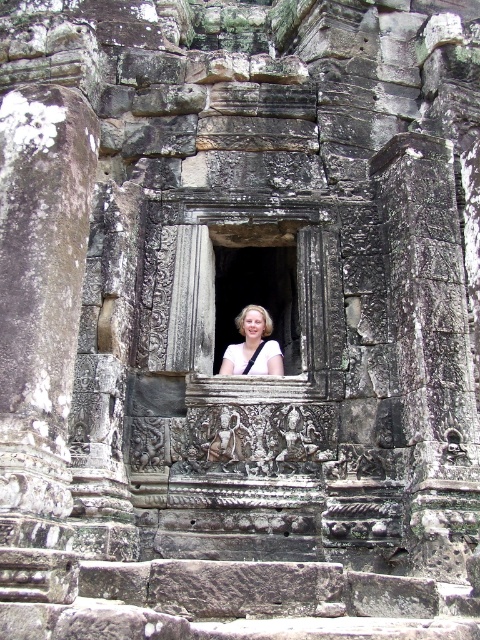
Question: Is transparent glass window at center positioned at the back of blonde hair at center?

Choices:
 (A) yes
 (B) no

Answer: (A)

Question: Can you confirm if transparent glass window at center is thinner than blonde hair at center?

Choices:
 (A) no
 (B) yes

Answer: (A)

Question: Can you confirm if transparent glass window at center is bigger than blonde hair at center?

Choices:
 (A) no
 (B) yes

Answer: (B)

Question: Which point appears closest to the camera in this image?

Choices:
 (A) (260, 323)
 (B) (268, 310)

Answer: (A)

Question: Which of the following is the farthest from the observer?

Choices:
 (A) (240, 328)
 (B) (228, 264)

Answer: (B)

Question: Which object appears farthest from the camera in this image?

Choices:
 (A) blonde hair at center
 (B) transparent glass window at center

Answer: (B)